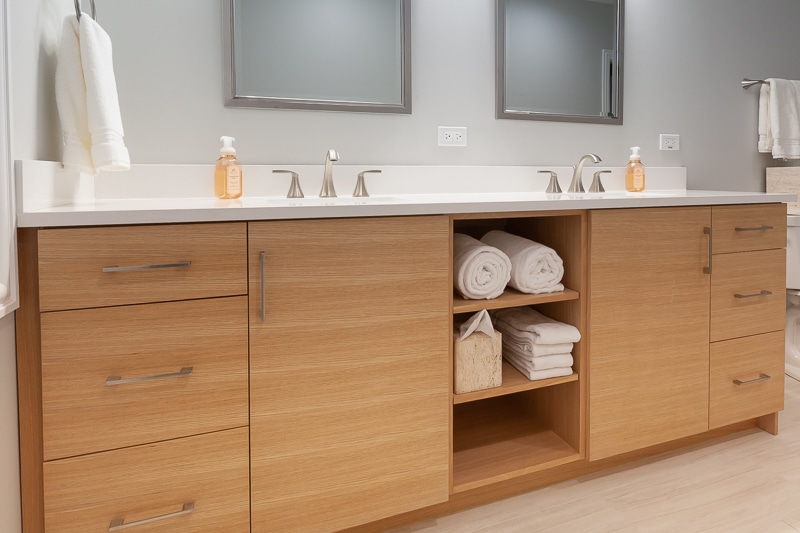
Identify the location of electrical outlet. The width and height of the screenshot is (800, 533). (440, 131), (674, 140).